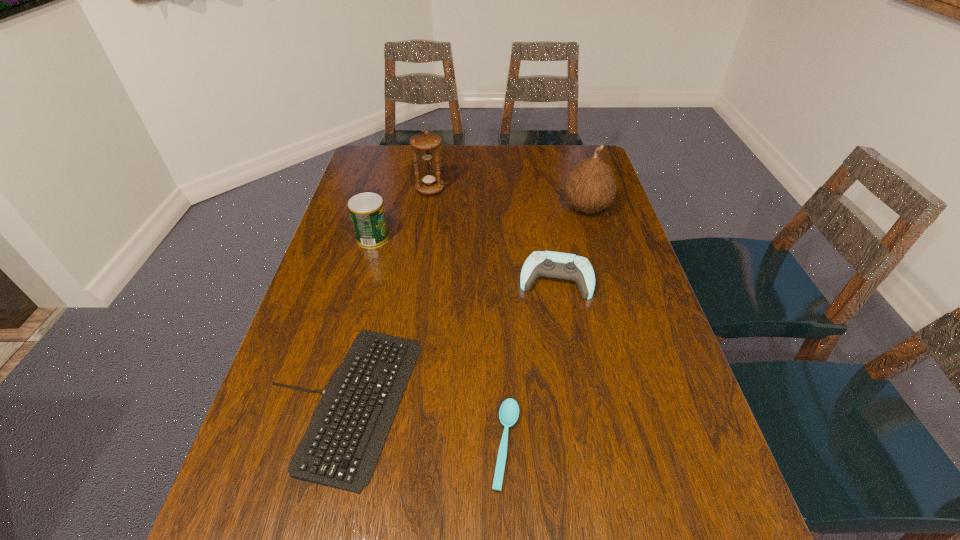
Find the location of a particular element. The height and width of the screenshot is (540, 960). vacant space positioned 0.050m on the surface of the tallest object is located at coordinates (544, 208).

This screenshot has height=540, width=960. What are the coordinates of `free space located on the surface of the tallest object` in the screenshot? It's located at (535, 208).

Where is `free spot located on the left of the second tallest object`? free spot located on the left of the second tallest object is located at coordinates (386, 189).

The height and width of the screenshot is (540, 960). Identify the location of free space located on the back of the third farthest object. pos(383,202).

Where is `vacant position located 0.320m on the back of the control`? This screenshot has width=960, height=540. vacant position located 0.320m on the back of the control is located at coordinates (540, 195).

Identify the location of vacant space located on the front of the fifth tallest object. The width and height of the screenshot is (960, 540). (305, 538).

The image size is (960, 540). I want to click on vacant space situated on the left of the third object from right to left, so click(x=362, y=444).

The image size is (960, 540). Identify the location of can at the left edge. (367, 213).

Where is `computer keyboard situated at the left edge`? The width and height of the screenshot is (960, 540). computer keyboard situated at the left edge is located at coordinates (340, 449).

Find the location of a particular element. The width and height of the screenshot is (960, 540). coconut located at the right edge is located at coordinates (590, 186).